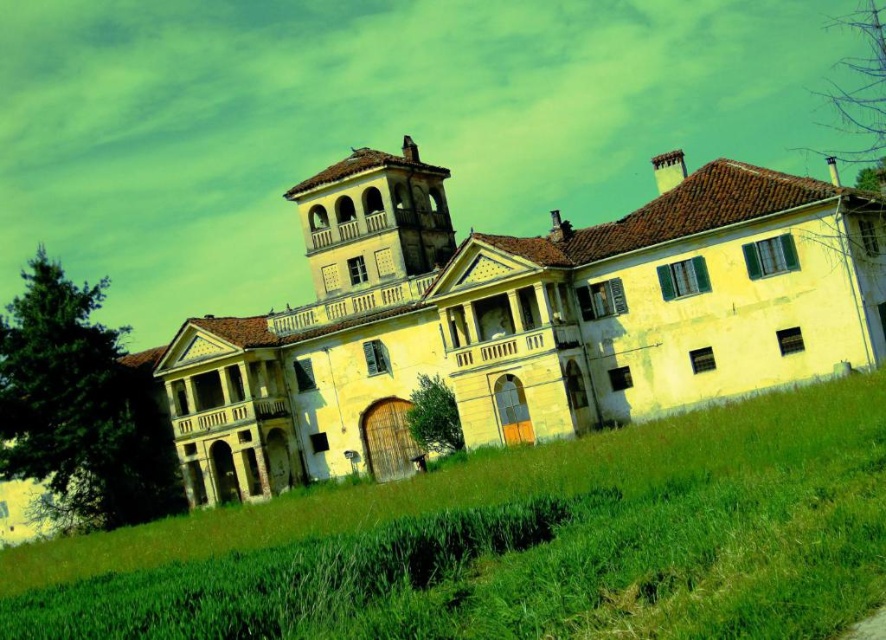
Which is in front, point (268, 346) or point (206, 636)?

Point (206, 636)

Between yellow matte building at center and green grassy field at lower center, which one is positioned higher?

yellow matte building at center

Is point (534, 349) farther from viewer compared to point (226, 584)?

Yes.

This screenshot has width=886, height=640. What are the coordinates of `yellow matte building at center` in the screenshot? It's located at (519, 320).